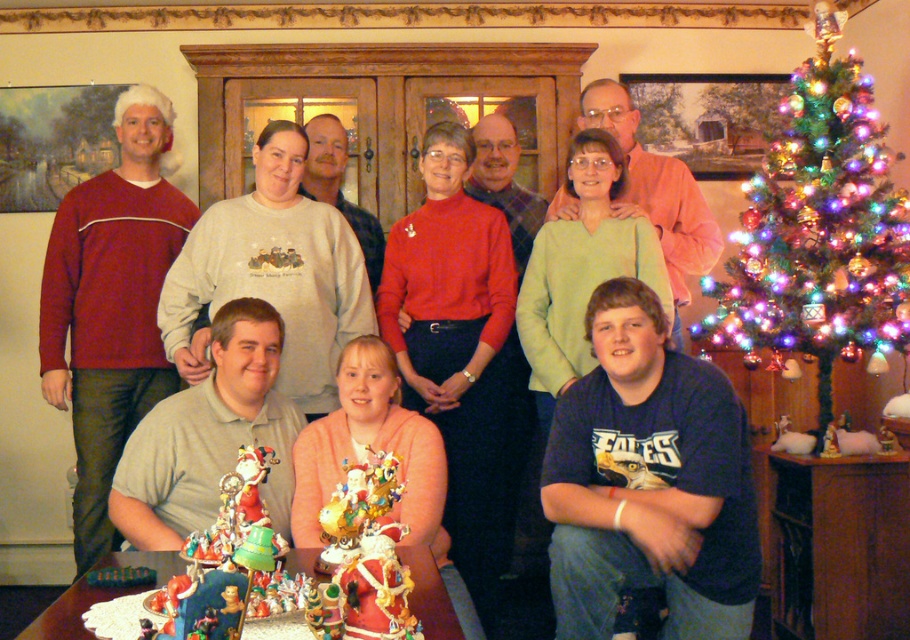
Question: Which object appears closest to the camera in this image?

Choices:
 (A) iridescent glass ornaments at right
 (B) matte gray sweater at center

Answer: (B)

Question: Does dark blue t-shirt at center appear on the right side of iridescent glass ornaments at right?

Choices:
 (A) no
 (B) yes

Answer: (A)

Question: Among these objects, which one is nearest to the camera?

Choices:
 (A) matte gray sweater at center
 (B) iridescent glass ornaments at right

Answer: (A)

Question: Which point appears farthest from the camera in this image?

Choices:
 (A) click(828, 32)
 (B) click(858, 464)
 (C) click(693, 404)

Answer: (A)

Question: Can you confirm if iridescent glass ornaments at right is thinner than wooden table at center?

Choices:
 (A) no
 (B) yes

Answer: (B)

Question: Where is dark blue t-shirt at center located in relation to matte gray sweater at center in the image?

Choices:
 (A) right
 (B) left

Answer: (A)